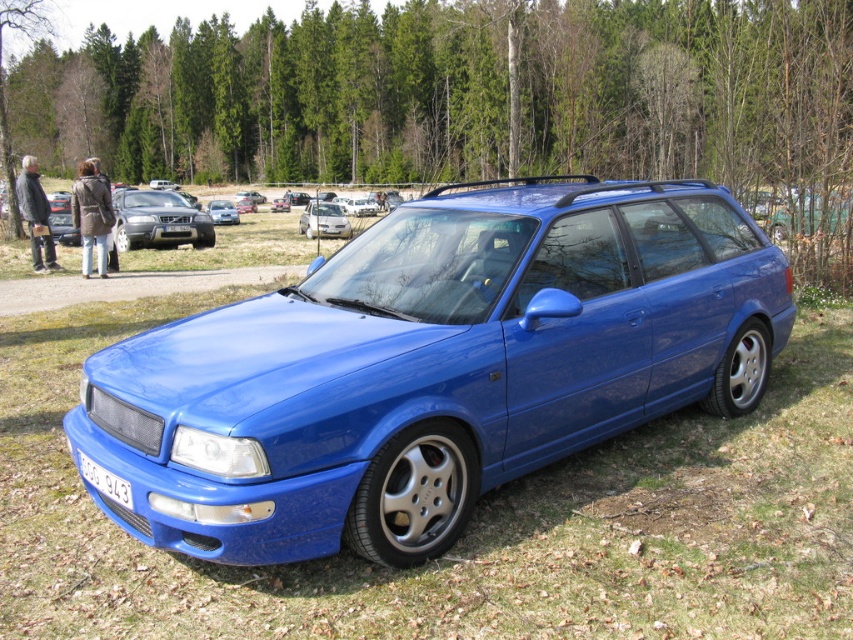
Question: Is satin silver sedan at upper left thinner than blue metallic hatchback at center?

Choices:
 (A) yes
 (B) no

Answer: (A)

Question: Which of the following is the closest to the observer?

Choices:
 (A) green grass at center
 (B) white plastic license plate at center

Answer: (A)

Question: Which is nearer to the satin silver sedan at upper left?

Choices:
 (A) white plastic license plate at lower center
 (B) blue metallic hatchback at center

Answer: (A)

Question: Can you confirm if white plastic license plate at lower center is bigger than blue metallic hatchback at center?

Choices:
 (A) yes
 (B) no

Answer: (B)

Question: Does satin silver sedan at upper left appear under blue metallic hatchback at center?

Choices:
 (A) no
 (B) yes

Answer: (B)

Question: Which of the following is the farthest from the observer?

Choices:
 (A) (224, 204)
 (B) (186, 225)
 (C) (305, 216)
 (D) (90, 580)

Answer: (A)